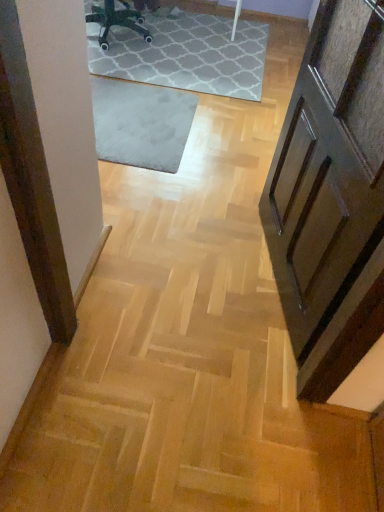
Question: Considering the relative sizes of wooden panelled door at right and black plastic chair at upper center in the image provided, is wooden panelled door at right smaller than black plastic chair at upper center?

Choices:
 (A) no
 (B) yes

Answer: (A)

Question: Would you say black plastic chair at upper center is part of wooden panelled door at right's contents?

Choices:
 (A) yes
 (B) no

Answer: (B)

Question: Is wooden panelled door at right not inside black plastic chair at upper center?

Choices:
 (A) yes
 (B) no

Answer: (A)

Question: Can you confirm if wooden panelled door at right is shorter than black plastic chair at upper center?

Choices:
 (A) no
 (B) yes

Answer: (A)

Question: Would you consider wooden panelled door at right to be distant from black plastic chair at upper center?

Choices:
 (A) no
 (B) yes

Answer: (B)

Question: From a real-world perspective, relative to gray soft rug at center, is black plastic chair at upper center vertically above or below?

Choices:
 (A) below
 (B) above

Answer: (B)

Question: Based on their sizes in the image, would you say black plastic chair at upper center is bigger or smaller than gray soft rug at center?

Choices:
 (A) big
 (B) small

Answer: (B)

Question: From the image's perspective, is black plastic chair at upper center above or below gray soft rug at center?

Choices:
 (A) above
 (B) below

Answer: (A)

Question: Is black plastic chair at upper center taller or shorter than gray soft rug at center?

Choices:
 (A) short
 (B) tall

Answer: (B)

Question: Considering the positions of black plastic chair at upper center and wooden panelled door at right in the image, is black plastic chair at upper center bigger or smaller than wooden panelled door at right?

Choices:
 (A) big
 (B) small

Answer: (B)

Question: From the image's perspective, relative to wooden panelled door at right, is black plastic chair at upper center above or below?

Choices:
 (A) below
 (B) above

Answer: (B)

Question: Do you think black plastic chair at upper center is within wooden panelled door at right, or outside of it?

Choices:
 (A) inside
 (B) outside

Answer: (B)

Question: Is black plastic chair at upper center in front of or behind wooden panelled door at right in the image?

Choices:
 (A) behind
 (B) front

Answer: (A)

Question: From the image's perspective, is wooden panelled door at right located above or below gray soft rug at center?

Choices:
 (A) below
 (B) above

Answer: (A)

Question: From their relative heights in the image, would you say wooden panelled door at right is taller or shorter than gray soft rug at center?

Choices:
 (A) tall
 (B) short

Answer: (A)